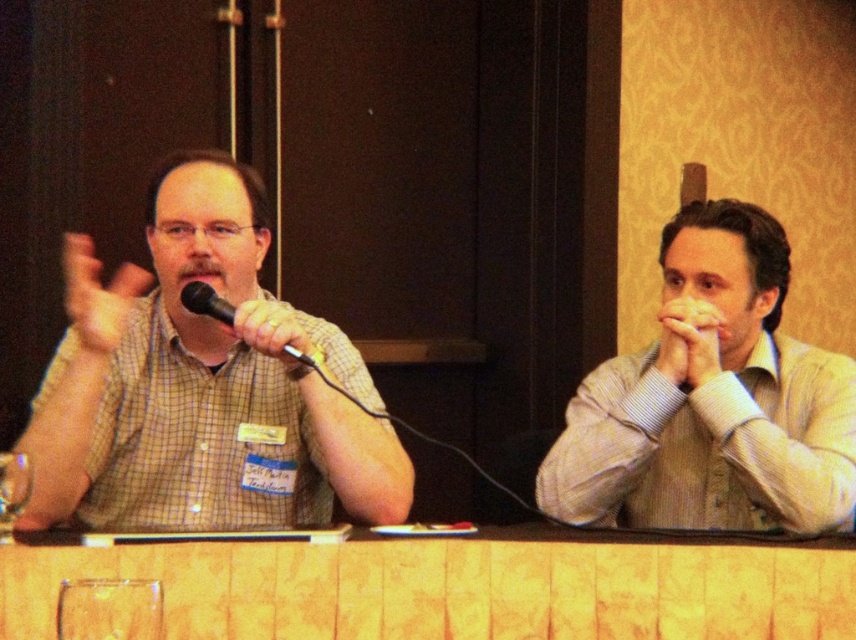
Question: From the image, what is the correct spatial relationship of matte yellow hand at upper left in relation to transparent glass at lower left?

Choices:
 (A) right
 (B) left

Answer: (B)

Question: Which of the following is the closest to the observer?

Choices:
 (A) (88, 304)
 (B) (684, 348)
 (C) (716, 353)
 (D) (390, 490)

Answer: (A)

Question: Does matte yellow hand at upper left appear on the right side of black metallic microphone at center?

Choices:
 (A) yes
 (B) no

Answer: (B)

Question: Which object is farther from the camera taking this photo?

Choices:
 (A) smooth skin hands at center
 (B) matte black microphone at center
 (C) wooden table at center

Answer: (A)

Question: Does checkered fabric shirt at left have a larger size compared to smooth skin hands at center?

Choices:
 (A) no
 (B) yes

Answer: (B)

Question: Which point is farther to the camera?

Choices:
 (A) matte black microphone at center
 (B) smooth skin hands at center
 (C) wooden table at center

Answer: (B)